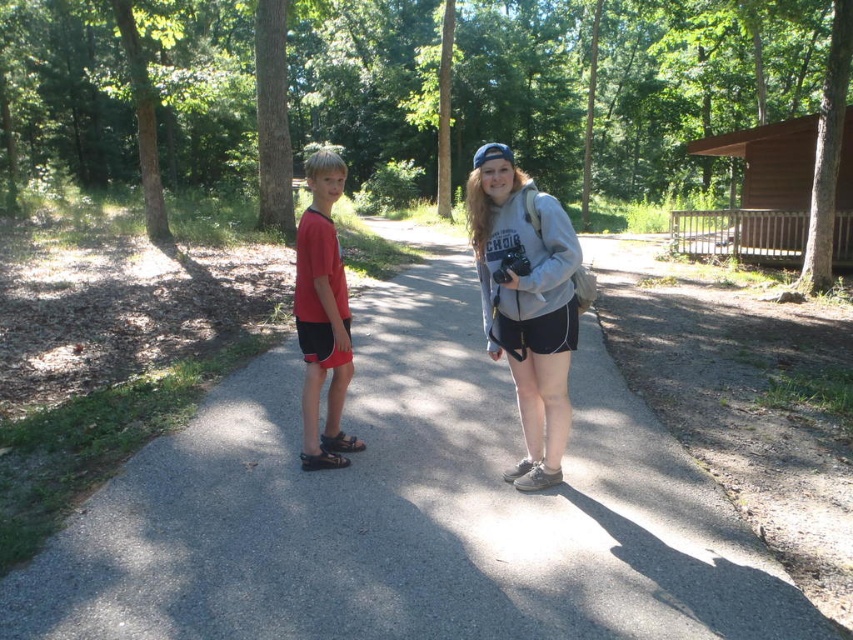
Question: Which object appears closest to the camera in this image?

Choices:
 (A) matte red t-shirt at center
 (B) gray fleece hoodie at center

Answer: (B)

Question: Observing the image, what is the correct spatial positioning of gray asphalt trail at center in reference to matte red t-shirt at center?

Choices:
 (A) below
 (B) above

Answer: (A)

Question: Which object appears closest to the camera in this image?

Choices:
 (A) gray fleece hoodie at center
 (B) gray asphalt trail at center
 (C) matte red t-shirt at center

Answer: (B)

Question: Does gray fleece hoodie at center have a lesser width compared to matte red t-shirt at center?

Choices:
 (A) no
 (B) yes

Answer: (B)

Question: Which object appears closest to the camera in this image?

Choices:
 (A) gray asphalt trail at center
 (B) matte red t-shirt at center

Answer: (A)

Question: Can you confirm if gray fleece hoodie at center is positioned to the right of matte red t-shirt at center?

Choices:
 (A) yes
 (B) no

Answer: (A)